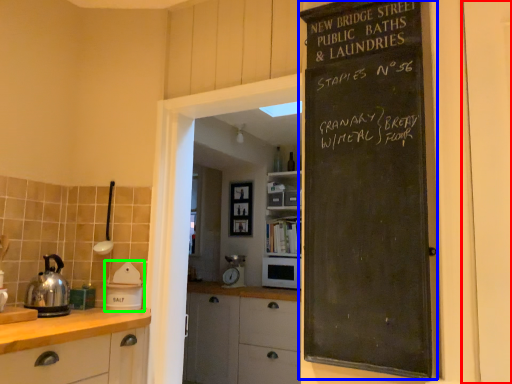
Question: Based on their relative distances, which object is nearer to door (highlighted by a red box)? Choose from bulletin board (highlighted by a blue box) and appliance (highlighted by a green box).

Choices:
 (A) bulletin board
 (B) appliance

Answer: (A)